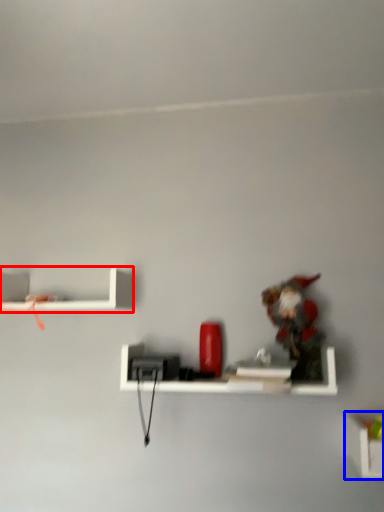
Question: Among these objects, which one is farthest to the camera, shelf (highlighted by a red box) or shelf (highlighted by a blue box)?

Choices:
 (A) shelf
 (B) shelf

Answer: (A)